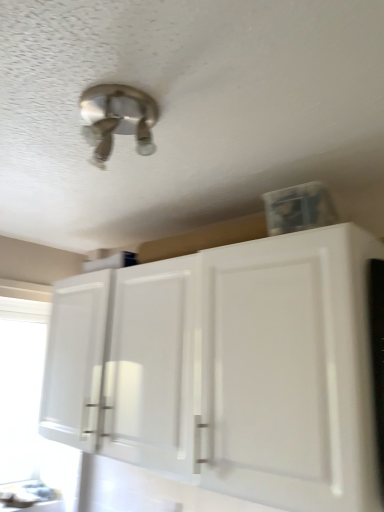
Question: From the image's perspective, is white glossy cabinet at lower right over transparent plastic window screen at left?

Choices:
 (A) no
 (B) yes

Answer: (B)

Question: From the image's perspective, does white glossy cabinet at lower right appear lower than transparent plastic window screen at left?

Choices:
 (A) no
 (B) yes

Answer: (A)

Question: Can you confirm if white glossy cabinet at lower right is taller than transparent plastic window screen at left?

Choices:
 (A) yes
 (B) no

Answer: (B)

Question: Are white glossy cabinet at lower right and transparent plastic window screen at left far apart?

Choices:
 (A) yes
 (B) no

Answer: (A)

Question: Is white glossy cabinet at lower right aimed at transparent plastic window screen at left?

Choices:
 (A) no
 (B) yes

Answer: (A)

Question: Choose the correct answer: Is satin nickel light fixture at upper center inside white glossy cabinet at lower right or outside it?

Choices:
 (A) inside
 (B) outside

Answer: (B)

Question: Is point coord(104,153) closer or farther from the camera than point coord(203,308)?

Choices:
 (A) farther
 (B) closer

Answer: (B)

Question: Considering the positions of satin nickel light fixture at upper center and white glossy cabinet at lower right in the image, is satin nickel light fixture at upper center bigger or smaller than white glossy cabinet at lower right?

Choices:
 (A) small
 (B) big

Answer: (A)

Question: In the image, is satin nickel light fixture at upper center positioned in front of or behind white glossy cabinet at lower right?

Choices:
 (A) behind
 (B) front

Answer: (B)

Question: Is satin nickel light fixture at upper center inside or outside of transparent plastic window screen at left?

Choices:
 (A) outside
 (B) inside

Answer: (A)

Question: From the image's perspective, is satin nickel light fixture at upper center above or below transparent plastic window screen at left?

Choices:
 (A) above
 (B) below

Answer: (A)

Question: From a real-world perspective, is satin nickel light fixture at upper center above or below transparent plastic window screen at left?

Choices:
 (A) below
 (B) above

Answer: (B)

Question: Is satin nickel light fixture at upper center taller or shorter than transparent plastic window screen at left?

Choices:
 (A) short
 (B) tall

Answer: (A)

Question: Would you say transparent plastic window screen at left is to the left or to the right of satin nickel light fixture at upper center in the picture?

Choices:
 (A) left
 (B) right

Answer: (A)

Question: Which is correct: transparent plastic window screen at left is inside satin nickel light fixture at upper center, or outside of it?

Choices:
 (A) inside
 (B) outside

Answer: (B)